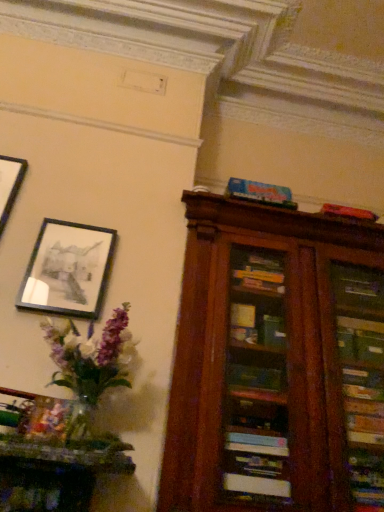
Image resolution: width=384 pixels, height=512 pixels. What do you see at coordinates (91, 362) in the screenshot? I see `translucent glass vase at left` at bounding box center [91, 362].

The width and height of the screenshot is (384, 512). Identify the location of matte black picture frame at upper left. (68, 270).

Locate an element on the screen. blue matte board game at upper center is located at coordinates click(x=259, y=192).

Is matte black picture frame at upper left positioned with its back to translucent glass vase at left?

No, matte black picture frame at upper left is not facing the opposite direction of translucent glass vase at left.

Is point (79, 295) closer to viewer compared to point (70, 323)?

No, it is not.

Considering the relative sizes of matte black picture frame at upper left and translucent glass vase at left in the image provided, is matte black picture frame at upper left taller than translucent glass vase at left?

Incorrect, the height of matte black picture frame at upper left is not larger of that of translucent glass vase at left.

Can you confirm if matte black picture frame at upper left is positioned to the right of translucent glass vase at left?

No, matte black picture frame at upper left is not to the right of translucent glass vase at left.

Choose the correct answer: Is blue matte board game at upper center inside translucent glass vase at left or outside it?

blue matte board game at upper center cannot be found inside translucent glass vase at left.

Does point (242, 183) lie in front of point (72, 361)?

No, it is behind (72, 361).

Is blue matte board game at upper center far from translucent glass vase at left?

Absolutely, blue matte board game at upper center is distant from translucent glass vase at left.

Which object is further away from the camera taking this photo, blue matte board game at upper center or translucent glass vase at left?

blue matte board game at upper center is further from the camera.

Can you confirm if matte black picture frame at upper left is taller than blue matte board game at upper center?

Yes.

Locate an element on the screen. paperback book on the right of matte black picture frame at upper left is located at coordinates (259, 192).

From a real-world perspective, is matte black picture frame at upper left on top of blue matte board game at upper center?

No.

From the image's perspective, which object appears higher, matte black picture frame at upper left or blue matte board game at upper center?

blue matte board game at upper center is shown above in the image.

Considering the sizes of objects blue matte board game at upper center and matte black picture frame at upper left in the image provided, who is smaller, blue matte board game at upper center or matte black picture frame at upper left?

Smaller between the two is matte black picture frame at upper left.

Is blue matte board game at upper center aimed at matte black picture frame at upper left?

No, blue matte board game at upper center is not aimed at matte black picture frame at upper left.

Is blue matte board game at upper center not near matte black picture frame at upper left?

That's not correct — blue matte board game at upper center is a little close to matte black picture frame at upper left.

Is blue matte board game at upper center taller than matte black picture frame at upper left?

No, blue matte board game at upper center is not taller than matte black picture frame at upper left.

Relative to matte black picture frame at upper left, is translucent glass vase at left in front or behind?

translucent glass vase at left is positioned closer to the viewer than matte black picture frame at upper left.

Is translucent glass vase at left oriented towards matte black picture frame at upper left?

No, translucent glass vase at left is not oriented towards matte black picture frame at upper left.

Image resolution: width=384 pixels, height=512 pixels. In order to click on floral arrangement lying in front of the matte black picture frame at upper left in this screenshot , I will do `click(91, 362)`.

From their relative heights in the image, would you say translucent glass vase at left is taller or shorter than matte black picture frame at upper left?

translucent glass vase at left is taller than matte black picture frame at upper left.

Considering the positions of objects translucent glass vase at left and blue matte board game at upper center in the image provided, who is behind, translucent glass vase at left or blue matte board game at upper center?

blue matte board game at upper center is further away from the camera.

Identify the location of paperback book located above the translucent glass vase at left (from a real-world perspective). This screenshot has width=384, height=512. (259, 192).

Is translucent glass vase at left inside or outside of blue matte board game at upper center?

translucent glass vase at left cannot be found inside blue matte board game at upper center.

Is translucent glass vase at left not close to blue matte board game at upper center?

Absolutely, translucent glass vase at left is distant from blue matte board game at upper center.

What are the coordinates of `picture frame above the translucent glass vase at left (from a real-world perspective)` in the screenshot? It's located at (68, 270).

Locate an element on the screen. paperback book to the right of translucent glass vase at left is located at coordinates (259, 192).

Which object lies further to the anchor point translucent glass vase at left, blue matte board game at upper center or matte black picture frame at upper left?

Based on the image, blue matte board game at upper center appears to be further to translucent glass vase at left.

Looking at the image, which one is located closer to matte black picture frame at upper left, blue matte board game at upper center or translucent glass vase at left?

Based on the image, translucent glass vase at left appears to be nearer to matte black picture frame at upper left.

Considering their positions, is matte black picture frame at upper left positioned further to translucent glass vase at left than blue matte board game at upper center?

The object further to translucent glass vase at left is blue matte board game at upper center.

Considering their positions, is translucent glass vase at left positioned closer to blue matte board game at upper center than matte black picture frame at upper left?

The object closer to blue matte board game at upper center is matte black picture frame at upper left.

Estimate the real-world distances between objects in this image. Which object is closer to matte black picture frame at upper left, translucent glass vase at left or blue matte board game at upper center?

Among the two, translucent glass vase at left is located nearer to matte black picture frame at upper left.

Estimate the real-world distances between objects in this image. Which object is closer to blue matte board game at upper center, matte black picture frame at upper left or translucent glass vase at left?

The object closer to blue matte board game at upper center is matte black picture frame at upper left.

At what (x,y) coordinates should I click in order to perform the action: click on picture frame between translucent glass vase at left and blue matte board game at upper center in the front-back direction. Please return your answer as a coordinate pair (x, y). Image resolution: width=384 pixels, height=512 pixels. Looking at the image, I should click on (68, 270).